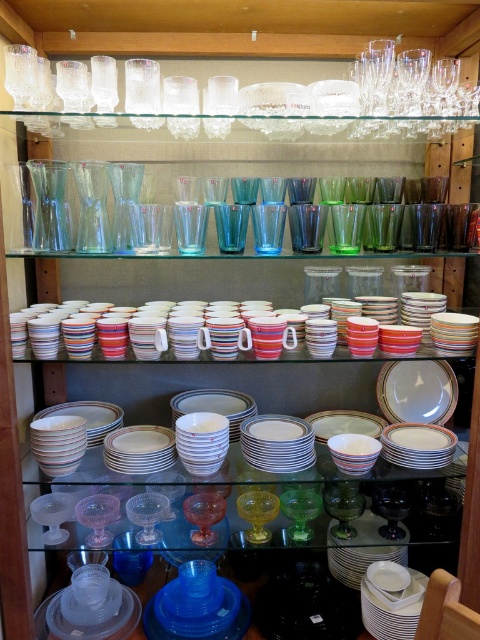
Question: Estimate the real-world distances between objects in this image. Which object is farther from the translucent yellow glass at center?

Choices:
 (A) white glossy plate at center
 (B) striped ceramic mug at center

Answer: (B)

Question: Which of the following is the closest to the observer?

Choices:
 (A) (88, 333)
 (B) (411, 369)
 (C) (259, 492)

Answer: (A)

Question: Can you confirm if striped ceramic mug at center is thinner than white glossy plate at center?

Choices:
 (A) yes
 (B) no

Answer: (B)

Question: Where is white glossy plate at center located in relation to translucent yellow glass at center in the image?

Choices:
 (A) below
 (B) above

Answer: (B)

Question: Among these points, which one is farthest from the camera?

Choices:
 (A) (267, 497)
 (B) (72, 328)
 (C) (410, 374)

Answer: (C)

Question: Can you confirm if white glossy plate at center is positioned to the left of translucent yellow glass at center?

Choices:
 (A) no
 (B) yes

Answer: (A)